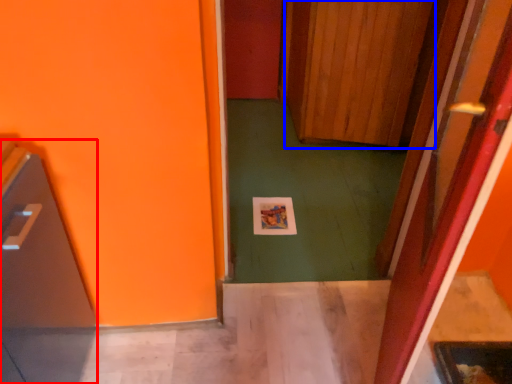
Question: Which point is further to the camera, appliance (highlighted by a red box) or door (highlighted by a blue box)?

Choices:
 (A) appliance
 (B) door

Answer: (B)